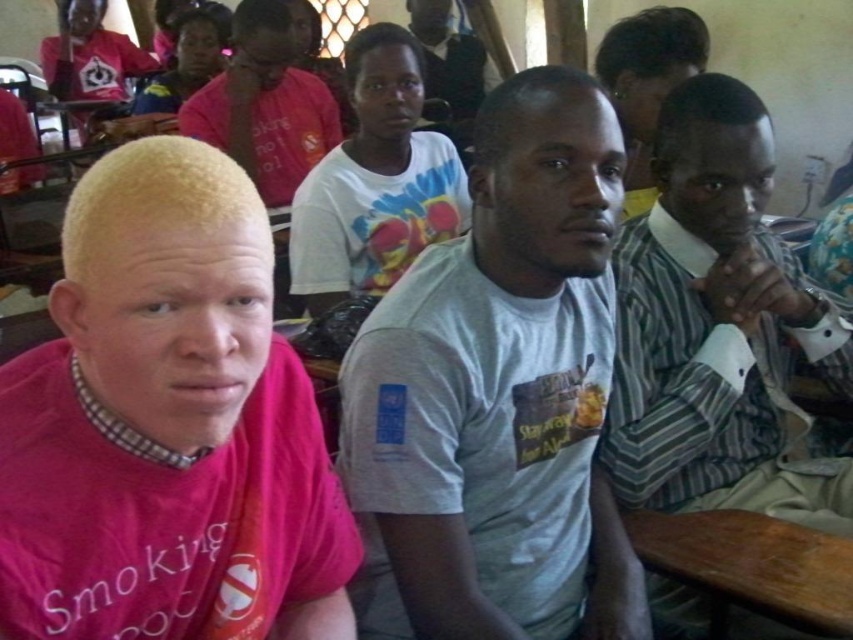
Question: Estimate the real-world distances between objects in this image. Which object is farther from the wooden table at lower right?

Choices:
 (A) striped fabric shirt at right
 (B) white matte t-shirt at center
 (C) pink matte shirt at upper center
 (D) pink matte shirt at left

Answer: (C)

Question: Among these objects, which one is farthest from the camera?

Choices:
 (A) pink matte shirt at upper center
 (B) pink matte shirt at left

Answer: (A)

Question: Does striped fabric shirt at right come in front of pink matte shirt at upper center?

Choices:
 (A) no
 (B) yes

Answer: (B)

Question: Is wooden table at lower right wider than pink matte shirt at upper center?

Choices:
 (A) no
 (B) yes

Answer: (A)

Question: Which point is closer to the camera?

Choices:
 (A) (260, 170)
 (B) (518, 168)
 (C) (271, 531)

Answer: (C)

Question: Is wooden table at lower right further to camera compared to pink matte shirt at upper center?

Choices:
 (A) no
 (B) yes

Answer: (A)